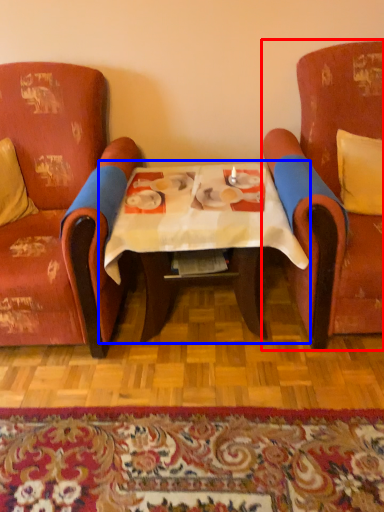
Question: Which point is further to the camera, chair (highlighted by a red box) or table (highlighted by a blue box)?

Choices:
 (A) chair
 (B) table

Answer: (B)